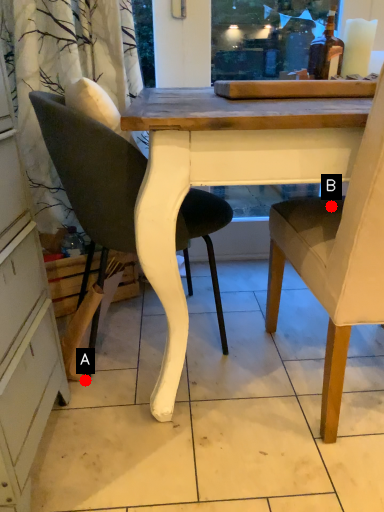
Question: Two points are circled on the image, labeled by A and B beside each circle. Among these points, which one is nearest to the camera?

Choices:
 (A) A is closer
 (B) B is closer

Answer: (B)